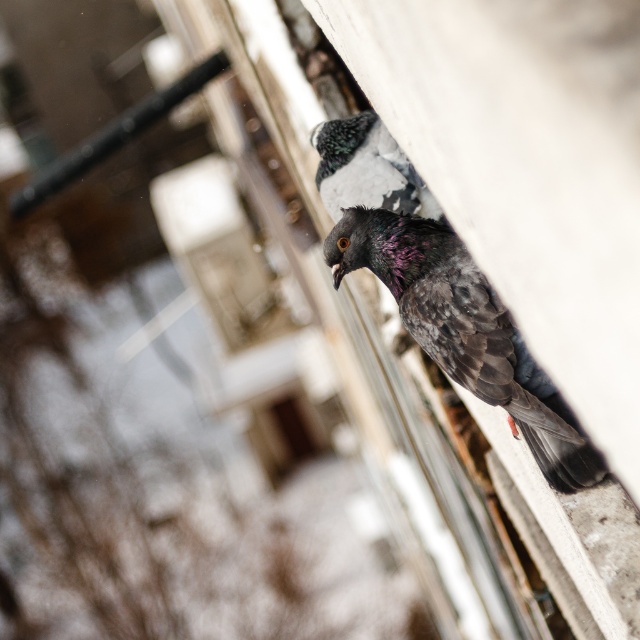
Question: Is shiny dark gray pigeon at upper right closer to camera compared to speckled feather pigeon at upper center?

Choices:
 (A) no
 (B) yes

Answer: (B)

Question: Is the position of shiny dark gray pigeon at upper right more distant than that of speckled feather pigeon at upper center?

Choices:
 (A) no
 (B) yes

Answer: (A)

Question: Which point is farther to the camera?

Choices:
 (A) (342, 128)
 (B) (481, 300)

Answer: (A)

Question: Which point is farther to the camera?

Choices:
 (A) shiny dark gray pigeon at upper right
 (B) speckled feather pigeon at upper center

Answer: (B)

Question: Does shiny dark gray pigeon at upper right come behind speckled feather pigeon at upper center?

Choices:
 (A) yes
 (B) no

Answer: (B)